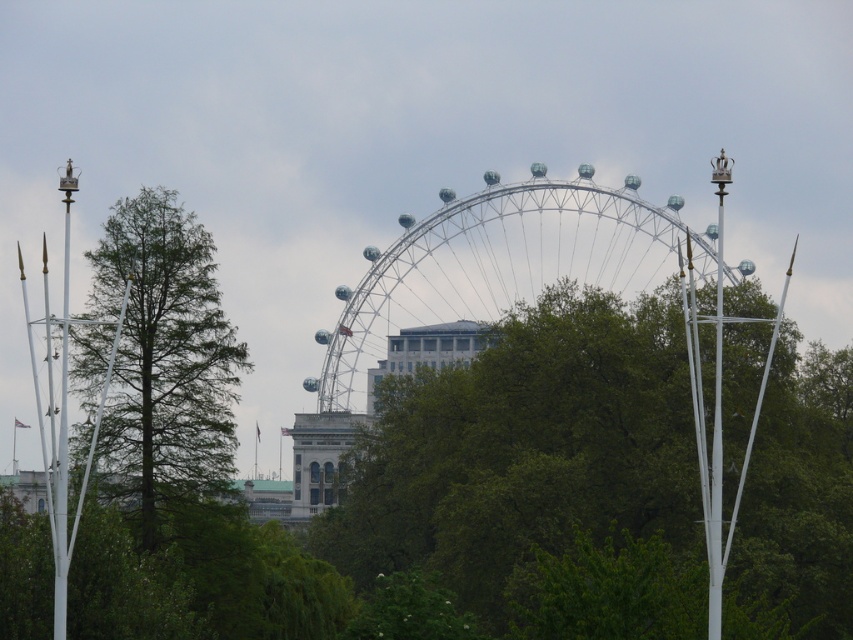
You are a photographer planning to capture a wide shot of the metallic silver ferris wheel at center and the green matte tree at left. Given their sizes, which object should you focus on to ensure both are fully visible in the frame?

The metallic silver ferris wheel at center is larger in size than the green matte tree at left, so you should focus on the metallic silver ferris wheel at center to ensure both are fully visible in the frame.

You are a tourist standing in front of the London Eye and notice two trees in the background. The trees are labeled as the green leafy tree at center and the green matte tree at left. Which tree is bigger in size?

The green leafy tree at center is larger in size compared to the green matte tree at left.

You are a photographer planning to capture a wide shot of the metallic silver ferris wheel at center and the green leafy tree at center. Based on their sizes, which one will occupy more space in your photo?

The green leafy tree at center is larger in size than the metallic silver ferris wheel at center, so it will occupy more space in the photo.